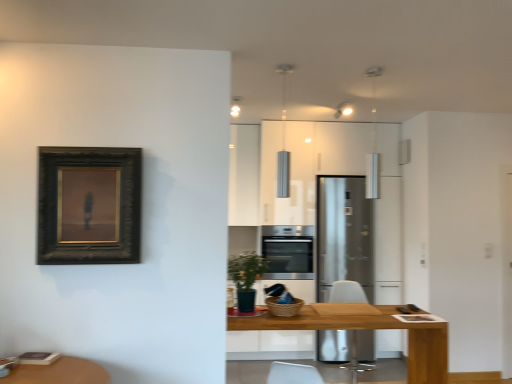
Question: Is dark wood frame at upper left wider or thinner than wooden table at center?

Choices:
 (A) wide
 (B) thin

Answer: (B)

Question: In terms of height, does dark wood frame at upper left look taller or shorter compared to wooden table at center?

Choices:
 (A) short
 (B) tall

Answer: (B)

Question: Which object is the closest to the satin silver refrigerator at center?

Choices:
 (A) white plastic swivel chair at center
 (B) wooden table at center
 (C) satin silver oven at center
 (D) dark wood frame at upper left

Answer: (C)

Question: Estimate the real-world distances between objects in this image. Which object is farther from the wooden table at center?

Choices:
 (A) satin silver refrigerator at center
 (B) satin silver oven at center
 (C) white plastic swivel chair at center
 (D) dark wood frame at upper left

Answer: (B)